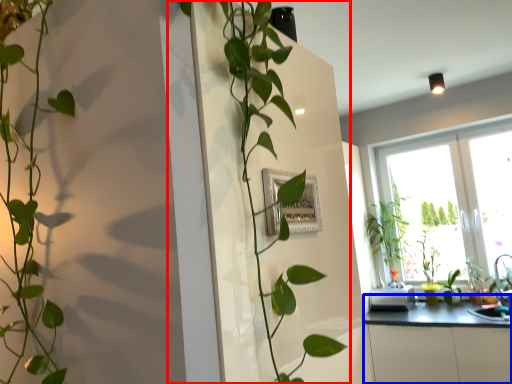
Question: Which of the following is the closest to the observer, houseplant (highlighted by a red box) or counter top (highlighted by a blue box)?

Choices:
 (A) houseplant
 (B) counter top

Answer: (A)